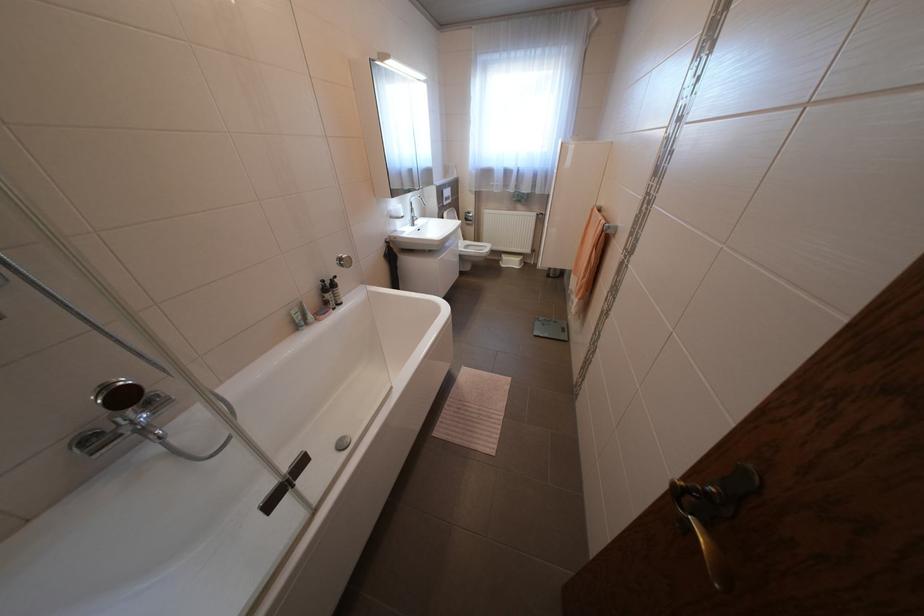
Find where to push the flush plate button. Please return your answer as a coordinate pair (x, y).

(342, 442)